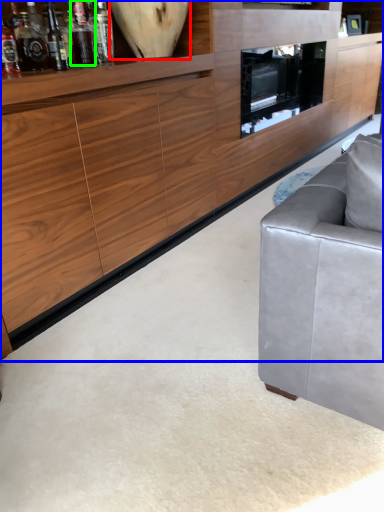
Question: Which object is positioned farthest from vase (highlighted by a red box)? Select from cabinetry (highlighted by a blue box) and bottle (highlighted by a green box).

Choices:
 (A) cabinetry
 (B) bottle

Answer: (A)